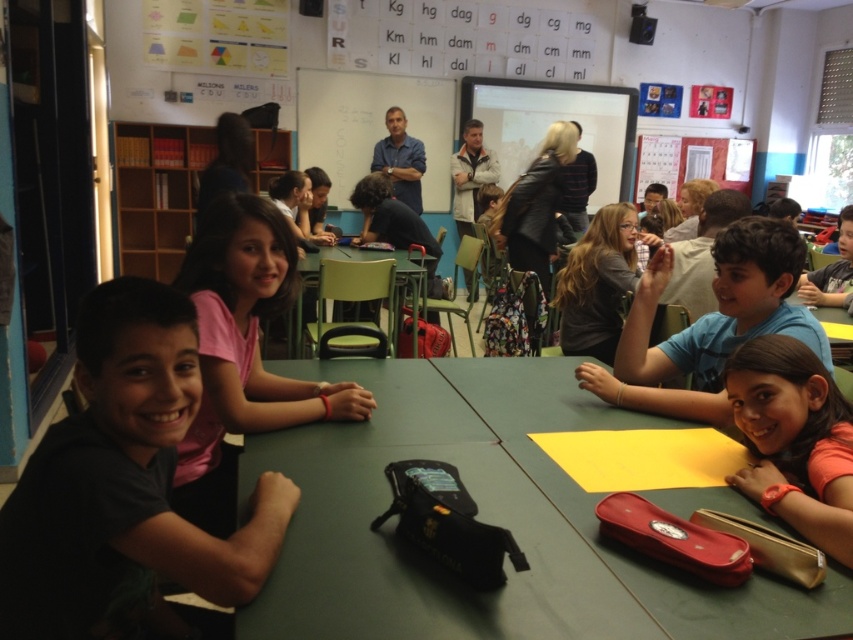
You are a teacher standing at the front of the classroom. You notice the orange matte shirt at lower right and the matte black backpack at center. Which object is positioned to the right of the other?

The orange matte shirt at lower right is to the right of the matte black backpack at center.

From the picture: You are a student sitting at the table in the classroom. You notice two points marked on the wall chart. Which point is closer to you, point (x=776, y=388) or point (x=390, y=216)?

Point (x=776, y=388) is closer to you than point (x=390, y=216).

You are a teacher organizing a classroom activity. You have a green matte table at center and a green plastic chair at center. Which object would you need to move first to make space for a new desk that requires more room? Explain your reasoning.

The green plastic chair at center is larger in size compared to the green matte table at center. Therefore, moving the green plastic chair at center first would create more space for the new desk.